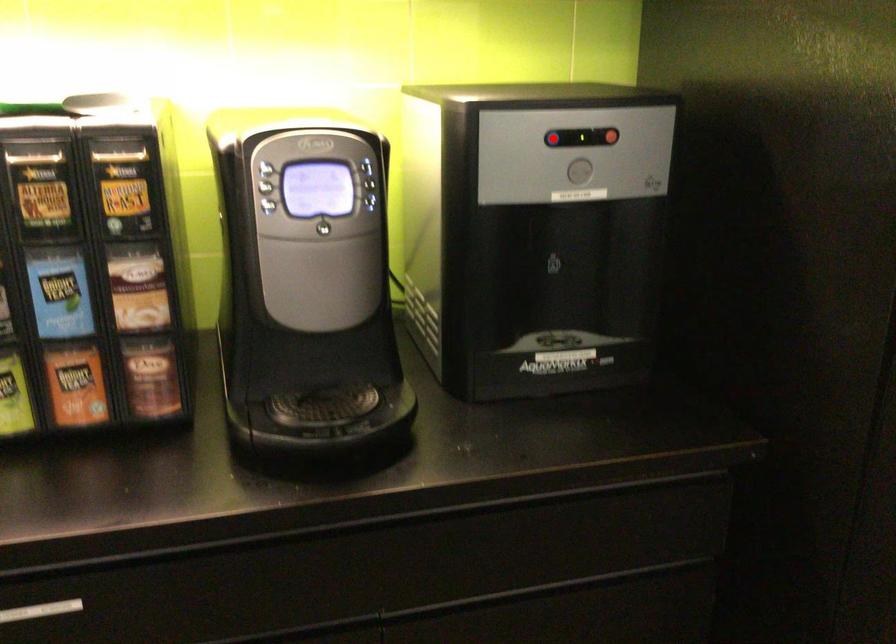
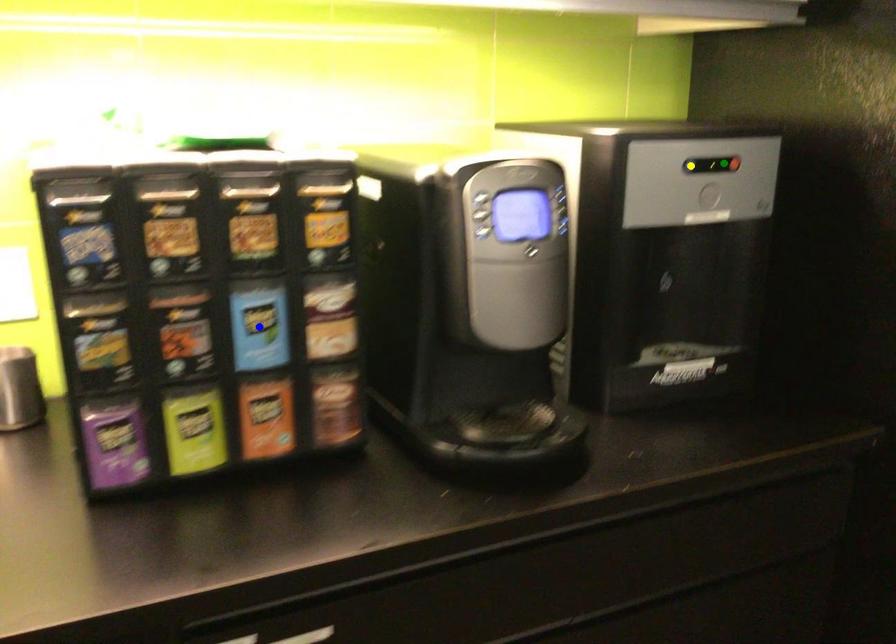
Question: I am providing you with two images of the same scene from different viewpoints. A red point is marked on the first image. You are given multiple points on the second image. Which mark in image 2 goes with the point in image 1?

Choices:
 (A) blue point
 (B) yellow point
 (C) green point

Answer: (B)